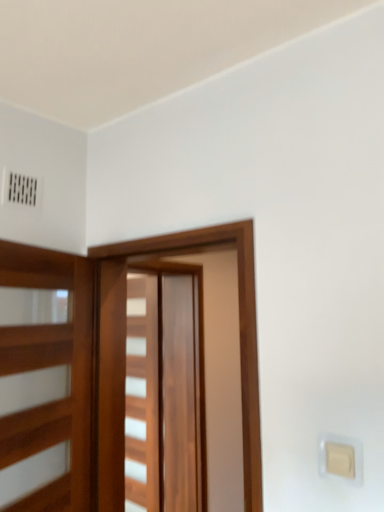
Question: In which direction should I rotate to look at wooden barn door at center, which is the 1th barn door in back-to-front order?

Choices:
 (A) left
 (B) right

Answer: (A)

Question: From the image's perspective, is wooden barn door at center, which is the 1th barn door in back-to-front order, located beneath beige plastic light switch at lower right?

Choices:
 (A) no
 (B) yes

Answer: (B)

Question: From a real-world perspective, is wooden barn door at center, which is the 1th barn door in back-to-front order, below beige plastic light switch at lower right?

Choices:
 (A) yes
 (B) no

Answer: (A)

Question: Does wooden barn door at center, which is the 1th barn door in back-to-front order, appear on the right side of beige plastic light switch at lower right?

Choices:
 (A) yes
 (B) no

Answer: (B)

Question: Is wooden barn door at center, acting as the second barn door starting from the front, located outside beige plastic light switch at lower right?

Choices:
 (A) yes
 (B) no

Answer: (A)

Question: Can you confirm if wooden barn door at center, acting as the second barn door starting from the front, is thinner than beige plastic light switch at lower right?

Choices:
 (A) yes
 (B) no

Answer: (B)

Question: From the image's perspective, does wooden barn door at center, acting as the second barn door starting from the front, appear higher than beige plastic light switch at lower right?

Choices:
 (A) no
 (B) yes

Answer: (A)

Question: Is beige plastic light switch at lower right positioned far away from wooden barn door at center, which is the 1th barn door in back-to-front order?

Choices:
 (A) yes
 (B) no

Answer: (A)

Question: From the image's perspective, is beige plastic light switch at lower right located above wooden barn door at center, which is the 1th barn door in back-to-front order?

Choices:
 (A) no
 (B) yes

Answer: (B)

Question: Does beige plastic light switch at lower right come behind wooden barn door at center, acting as the second barn door starting from the front?

Choices:
 (A) no
 (B) yes

Answer: (A)

Question: Can you confirm if beige plastic light switch at lower right is shorter than wooden barn door at center, acting as the second barn door starting from the front?

Choices:
 (A) no
 (B) yes

Answer: (B)

Question: Does beige plastic light switch at lower right have a greater width compared to wooden barn door at center, acting as the second barn door starting from the front?

Choices:
 (A) yes
 (B) no

Answer: (B)

Question: Does beige plastic light switch at lower right appear on the left side of wooden barn door at center, acting as the second barn door starting from the front?

Choices:
 (A) yes
 (B) no

Answer: (B)

Question: Could you tell me if wooden barn door at center, which is the 1th barn door from front to back, is turned towards wooden barn door at center, which is the 1th barn door in back-to-front order?

Choices:
 (A) no
 (B) yes

Answer: (A)